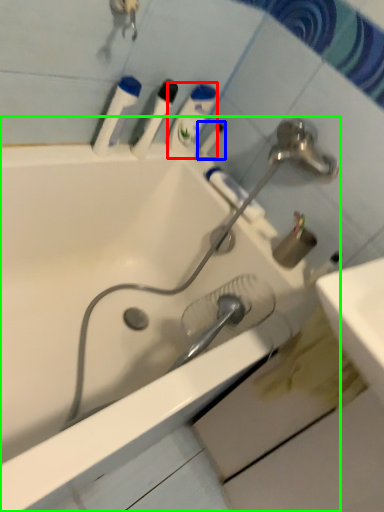
Question: Which is farther away from mouthwash (highlighted by a red box)? toothbrush (highlighted by a blue box) or bathtub (highlighted by a green box)?

Choices:
 (A) toothbrush
 (B) bathtub

Answer: (B)